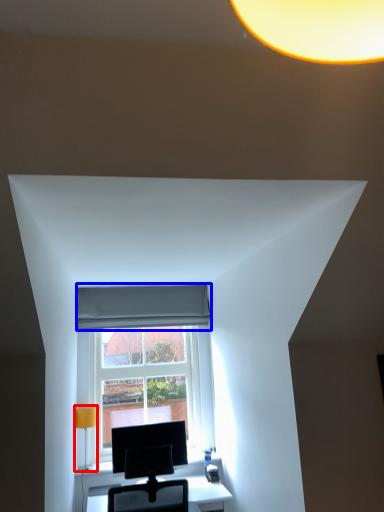
Question: Which of the following is the closest to the observer, table lamp (highlighted by a red box) or curtain (highlighted by a blue box)?

Choices:
 (A) table lamp
 (B) curtain

Answer: (A)